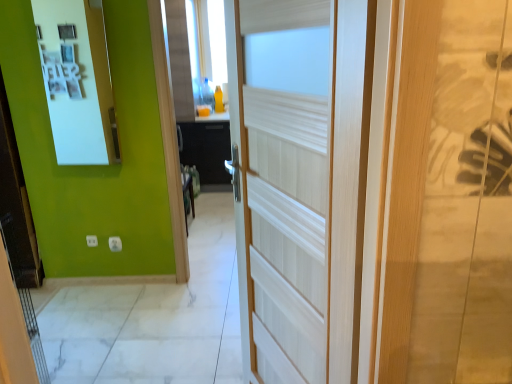
Question: Is white wood door at center bigger than white glossy medicine cabinet at upper left?

Choices:
 (A) no
 (B) yes

Answer: (B)

Question: From a real-world perspective, does white wood door at center stand above white glossy medicine cabinet at upper left?

Choices:
 (A) yes
 (B) no

Answer: (B)

Question: Does white wood door at center have a smaller size compared to white glossy medicine cabinet at upper left?

Choices:
 (A) no
 (B) yes

Answer: (A)

Question: Does white wood door at center appear on the right side of white glossy medicine cabinet at upper left?

Choices:
 (A) yes
 (B) no

Answer: (A)

Question: From the image's perspective, is white wood door at center on top of white glossy medicine cabinet at upper left?

Choices:
 (A) no
 (B) yes

Answer: (A)

Question: Are white wood door at center and white glossy medicine cabinet at upper left far apart?

Choices:
 (A) no
 (B) yes

Answer: (B)

Question: Is white glossy medicine cabinet at upper left taller than white wood door at center?

Choices:
 (A) yes
 (B) no

Answer: (B)

Question: Is white glossy medicine cabinet at upper left in contact with white wood door at center?

Choices:
 (A) no
 (B) yes

Answer: (A)

Question: Does white glossy medicine cabinet at upper left have a lesser width compared to white wood door at center?

Choices:
 (A) no
 (B) yes

Answer: (B)

Question: From the image's perspective, is white glossy medicine cabinet at upper left over white wood door at center?

Choices:
 (A) yes
 (B) no

Answer: (A)

Question: Considering the relative positions of white glossy medicine cabinet at upper left and white wood door at center in the image provided, is white glossy medicine cabinet at upper left to the right of white wood door at center from the viewer's perspective?

Choices:
 (A) no
 (B) yes

Answer: (A)

Question: Is white glossy medicine cabinet at upper left further to camera compared to white wood door at center?

Choices:
 (A) yes
 (B) no

Answer: (A)

Question: From a real-world perspective, relative to white glossy medicine cabinet at upper left, is white wood door at center vertically above or below?

Choices:
 (A) above
 (B) below

Answer: (B)